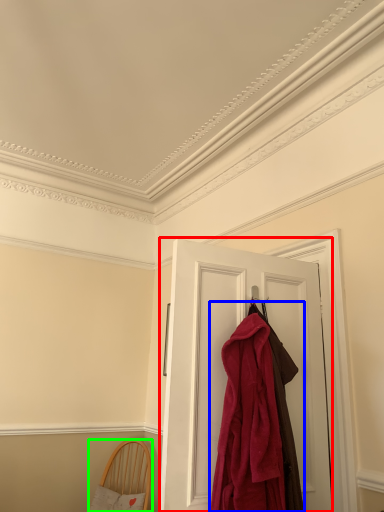
Question: Estimate the real-world distances between objects in this image. Which object is farther from door (highlighted by a red box), cloak (highlighted by a blue box) or furniture (highlighted by a green box)?

Choices:
 (A) cloak
 (B) furniture

Answer: (B)